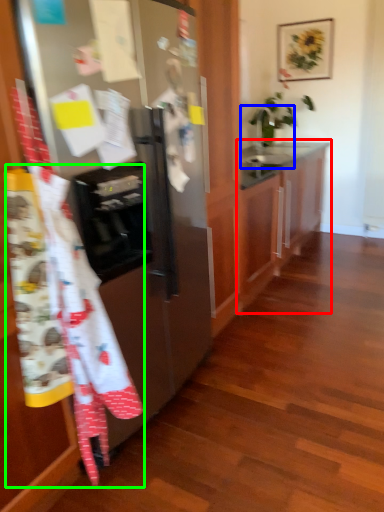
Question: Based on their relative distances, which object is nearer to cabinetry (highlighted by a red box)? Choose from sink (highlighted by a blue box) and blanket (highlighted by a green box).

Choices:
 (A) sink
 (B) blanket

Answer: (A)